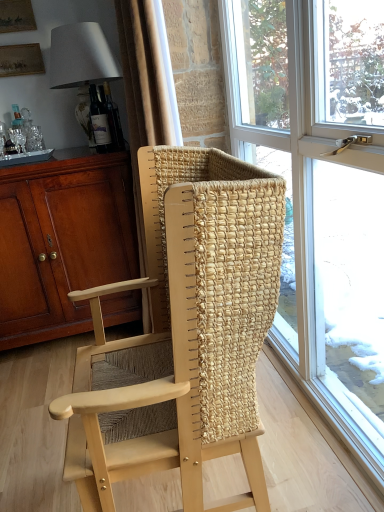
Question: Should I look upward or downward to see matte brown cabinet at left?

Choices:
 (A) up
 (B) down

Answer: (A)

Question: Is matte brown cabinet at left positioned with its back to beige fabric curtain at upper center?

Choices:
 (A) no
 (B) yes

Answer: (A)

Question: Considering the relative positions of matte brown cabinet at left and beige fabric curtain at upper center in the image provided, is matte brown cabinet at left to the right of beige fabric curtain at upper center from the viewer's perspective?

Choices:
 (A) no
 (B) yes

Answer: (A)

Question: Is matte brown cabinet at left bigger than beige fabric curtain at upper center?

Choices:
 (A) yes
 (B) no

Answer: (A)

Question: Does matte brown cabinet at left have a lesser width compared to beige fabric curtain at upper center?

Choices:
 (A) yes
 (B) no

Answer: (B)

Question: From the image's perspective, does matte brown cabinet at left appear lower than beige fabric curtain at upper center?

Choices:
 (A) no
 (B) yes

Answer: (B)

Question: Can you confirm if matte brown cabinet at left is wider than beige fabric curtain at upper center?

Choices:
 (A) no
 (B) yes

Answer: (B)

Question: Is clear glass window at center positioned beyond the bounds of matte brown cabinet at left?

Choices:
 (A) no
 (B) yes

Answer: (B)

Question: Is clear glass window at center at the left side of matte brown cabinet at left?

Choices:
 (A) no
 (B) yes

Answer: (A)

Question: From the image's perspective, is clear glass window at center below matte brown cabinet at left?

Choices:
 (A) no
 (B) yes

Answer: (A)

Question: Considering the relative positions of clear glass window at center and matte brown cabinet at left in the image provided, is clear glass window at center to the right of matte brown cabinet at left from the viewer's perspective?

Choices:
 (A) no
 (B) yes

Answer: (B)

Question: Is clear glass window at center bigger than matte brown cabinet at left?

Choices:
 (A) yes
 (B) no

Answer: (B)

Question: Considering the relative sizes of clear glass window at center and matte brown cabinet at left in the image provided, is clear glass window at center thinner than matte brown cabinet at left?

Choices:
 (A) no
 (B) yes

Answer: (B)

Question: Is matte gray lampshade at upper left facing away from matte brown cabinet at left?

Choices:
 (A) no
 (B) yes

Answer: (A)